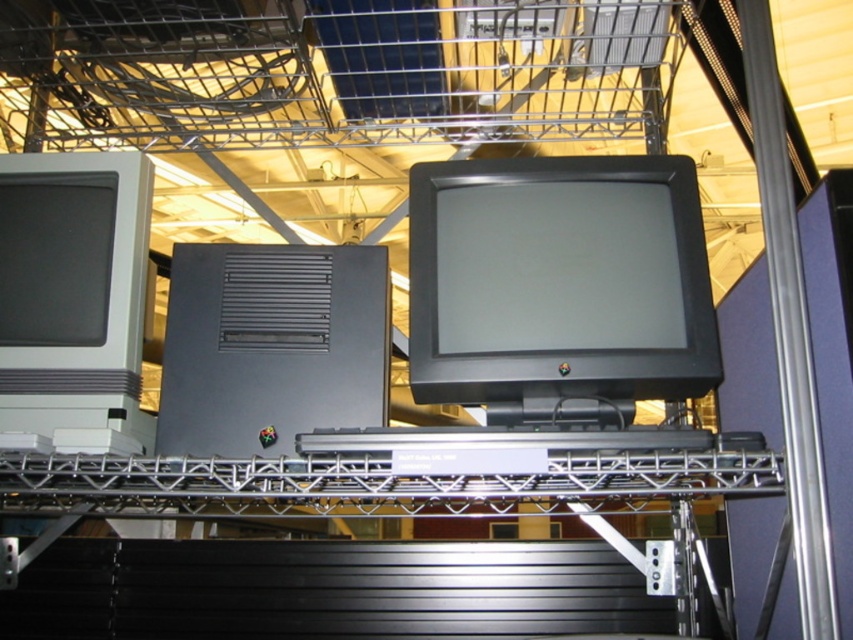
You are an archivist tasked with labeling items in the image. You notice a point at coordinates (558, 280). What object is located at that point?

The object at point (558, 280) is the matte black monitor at center.

You are setting up a display in an exhibition hall and need to arrange the black plastic computer at center and the matte gray monitor at left. Based on their sizes, which one should be placed on the lower shelf to ensure stability?

The black plastic computer at center is not as tall as the matte gray monitor at left, so it should be placed on the lower shelf to ensure stability since shorter items are typically placed lower for stability.

Looking at this image, you are an engineer trying to locate the matte black monitor at center in the image. According to the coordinates provided, where would you expect to find it in the image?

The matte black monitor at center is located at coordinates point (558, 280).